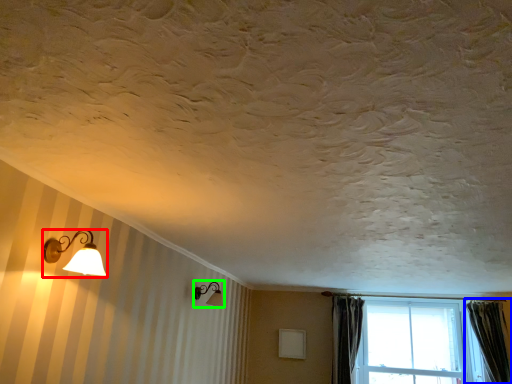
Question: Based on their relative distances, which object is nearer to lamp (highlighted by a red box)? Choose from curtain (highlighted by a blue box) and lamp (highlighted by a green box).

Choices:
 (A) curtain
 (B) lamp

Answer: (B)